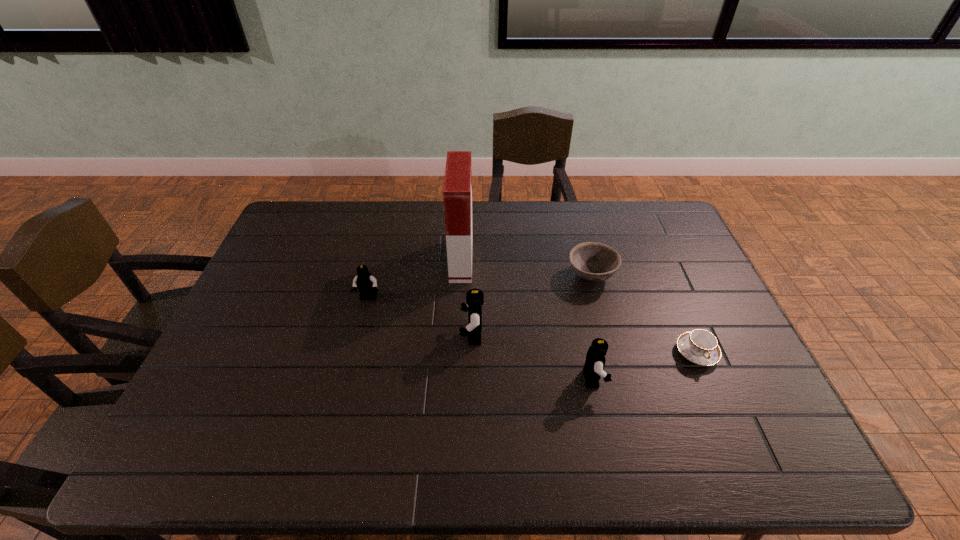
Find the location of a particular element. vacant spot to place a Lego on the left is located at coordinates (279, 267).